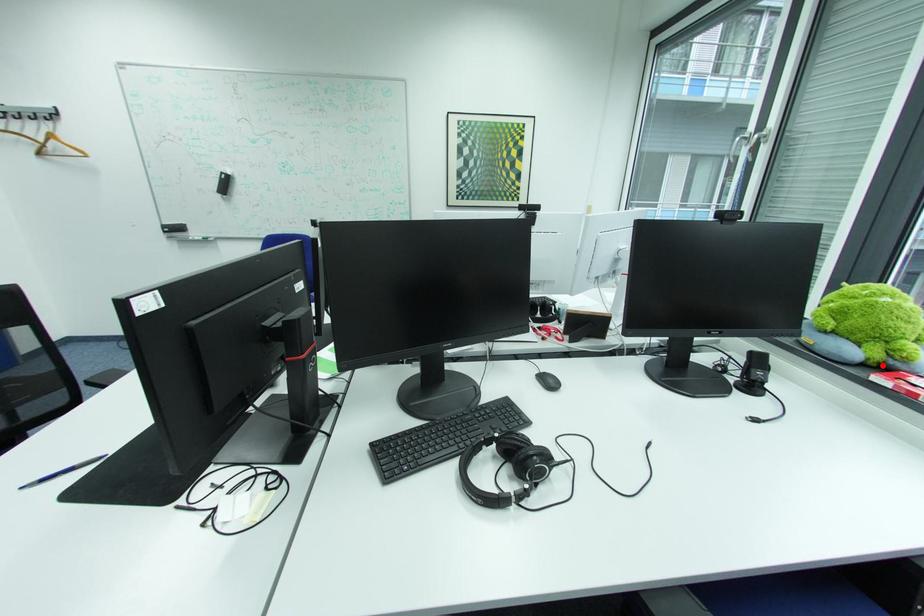
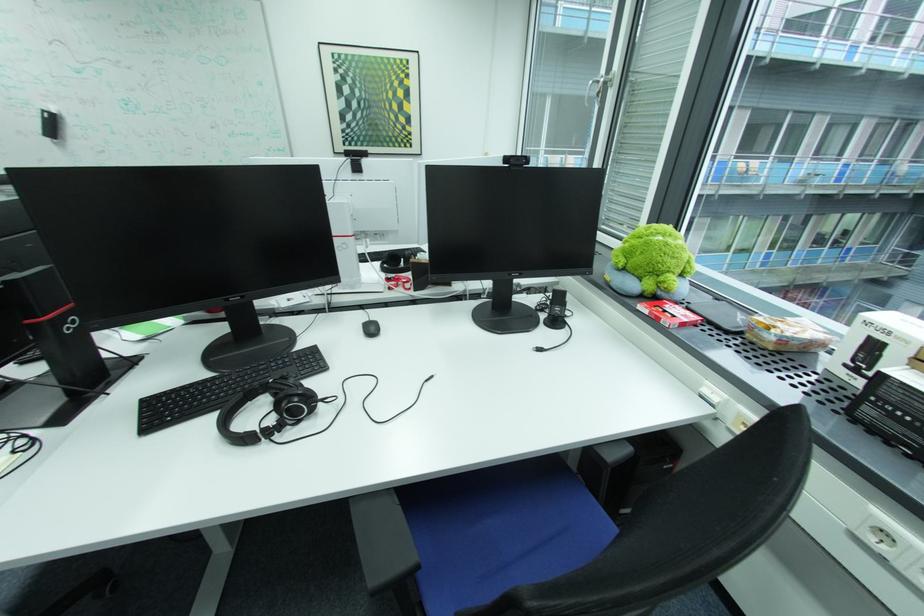
Find the pixel in the second image that matches the highlighted location in the first image.

(659, 297)